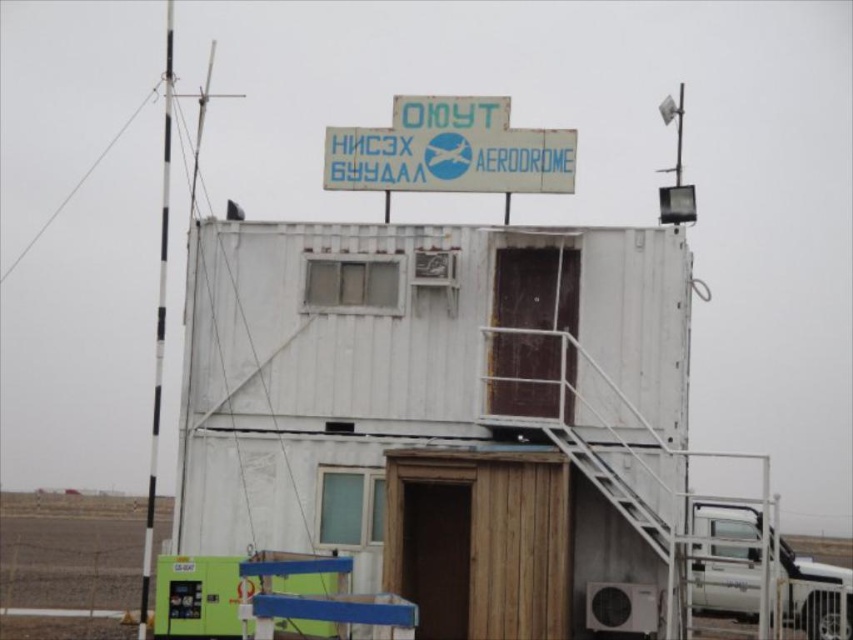
Question: Can you confirm if white plastic sign at upper center is positioned above white metallic truck at lower right?

Choices:
 (A) yes
 (B) no

Answer: (A)

Question: Which point is farther to the camera?

Choices:
 (A) white wooden shed at center
 (B) white plastic sign at upper center
 (C) white metallic truck at lower right

Answer: (C)

Question: Which object is closer to the camera taking this photo?

Choices:
 (A) white metallic truck at lower right
 (B) white wooden shed at center

Answer: (B)

Question: Which object appears closest to the camera in this image?

Choices:
 (A) white wooden shed at center
 (B) white metallic truck at lower right
 (C) white plastic sign at upper center

Answer: (A)

Question: Is white wooden shed at center behind white plastic sign at upper center?

Choices:
 (A) yes
 (B) no

Answer: (B)

Question: From the image, what is the correct spatial relationship of white wooden shed at center in relation to white metallic truck at lower right?

Choices:
 (A) above
 (B) below

Answer: (A)